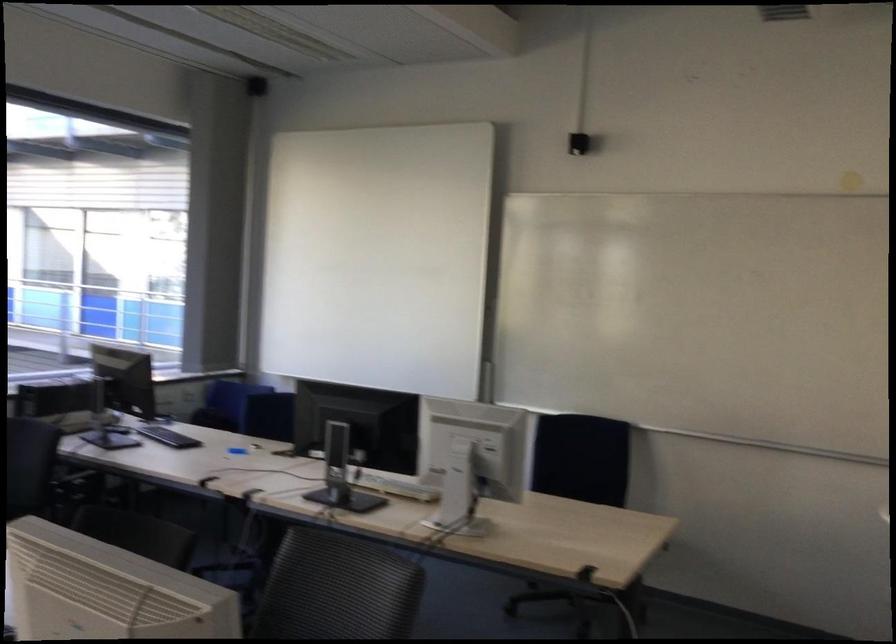
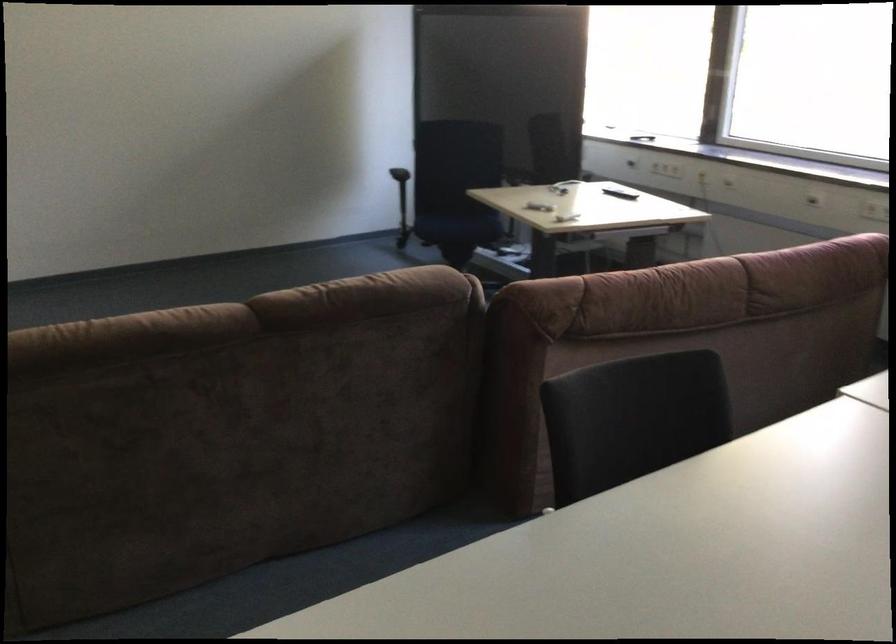
Based on the continuous images, in which direction is the camera rotating?

The camera's rotation is toward left-down.